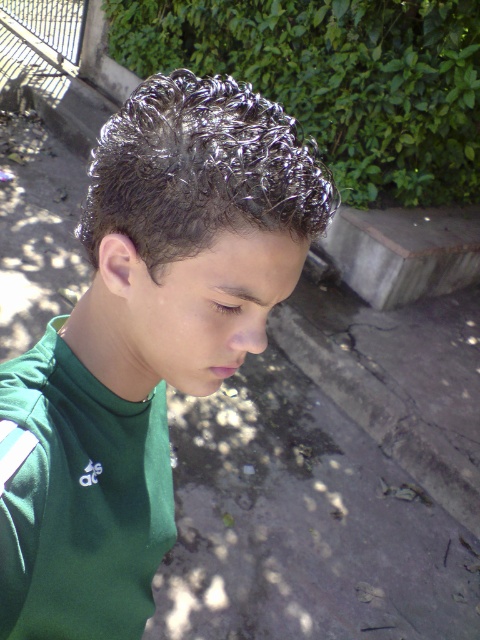
Question: Is green matte shirt at center thinner than shiny metallic hair at upper center?

Choices:
 (A) no
 (B) yes

Answer: (B)

Question: Which point is closer to the camera?

Choices:
 (A) (103, 196)
 (B) (140, 244)

Answer: (B)

Question: Is green matte shirt at center positioned behind shiny metallic hair at upper center?

Choices:
 (A) yes
 (B) no

Answer: (B)

Question: Does green matte shirt at center have a lesser width compared to shiny metallic hair at upper center?

Choices:
 (A) yes
 (B) no

Answer: (A)

Question: Which of the following is the closest to the observer?

Choices:
 (A) (145, 250)
 (B) (132, 189)

Answer: (B)